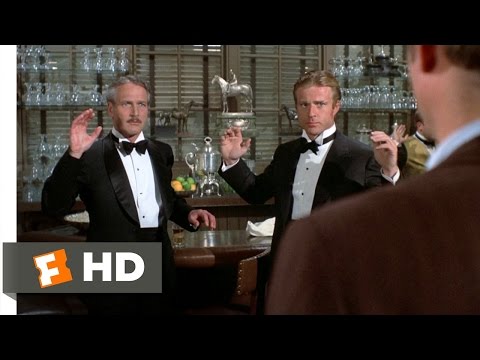
In order to click on shelves in this screenshot , I will do `click(63, 68)`, `click(55, 106)`, `click(381, 109)`.